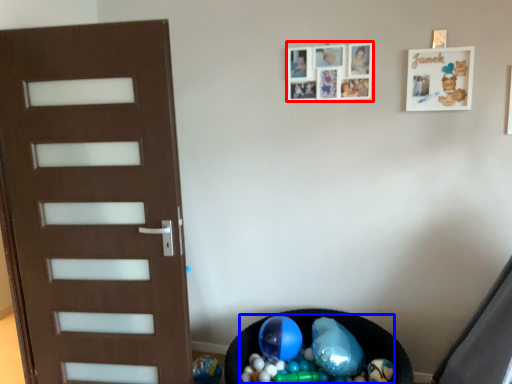
Question: Which object is closer to the camera taking this photo, picture frame (highlighted by a red box) or garbage (highlighted by a blue box)?

Choices:
 (A) picture frame
 (B) garbage

Answer: (B)